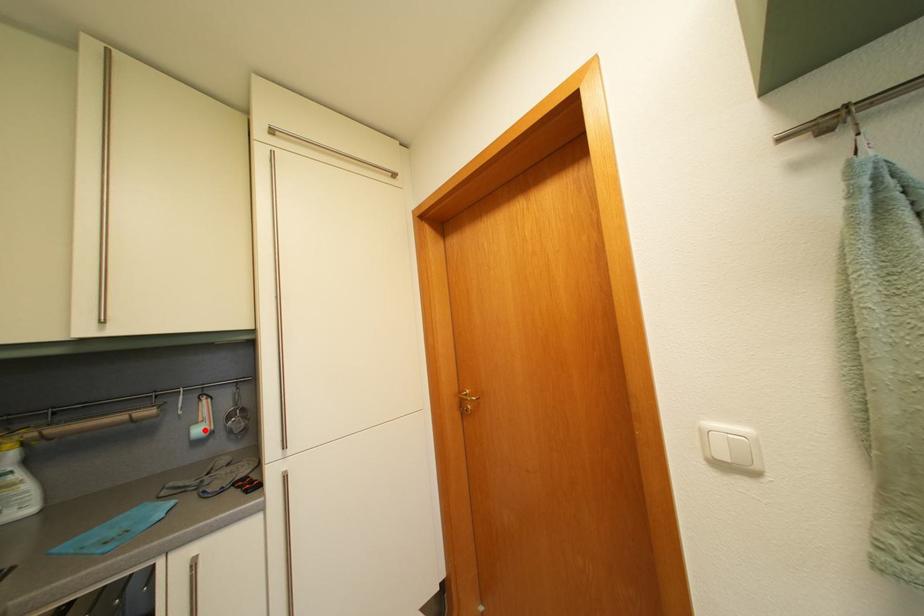
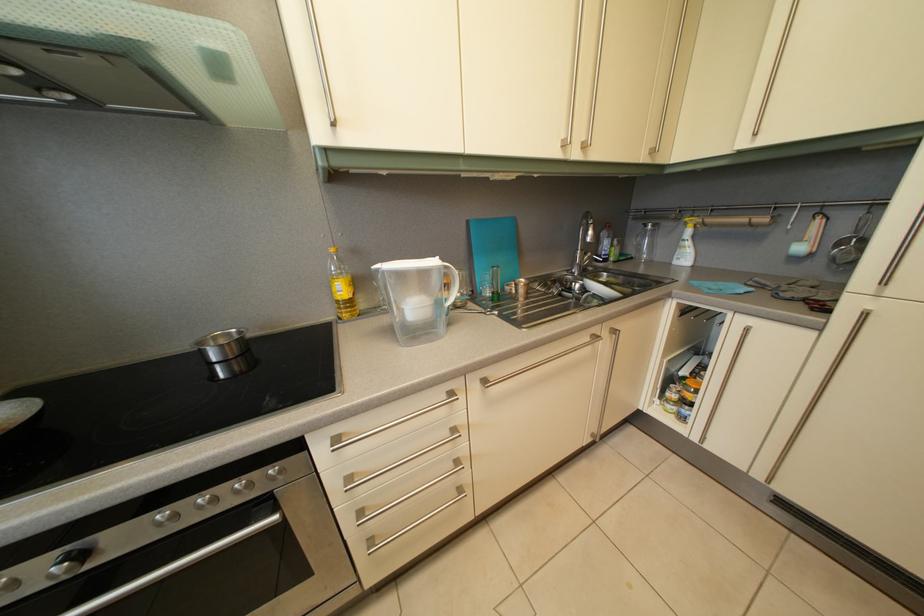
Find the pixel in the second image that matches the highlighted location in the first image.

(808, 248)